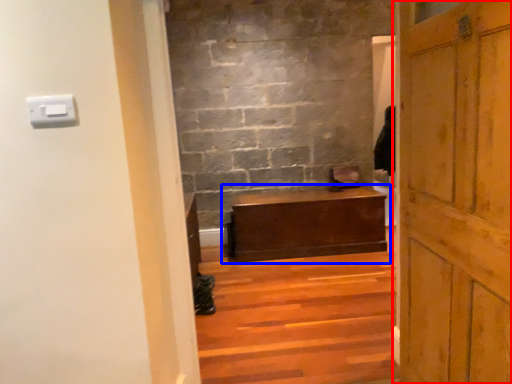
Question: Which of the following is the farthest to the observer, door (highlighted by a red box) or table (highlighted by a blue box)?

Choices:
 (A) door
 (B) table

Answer: (B)